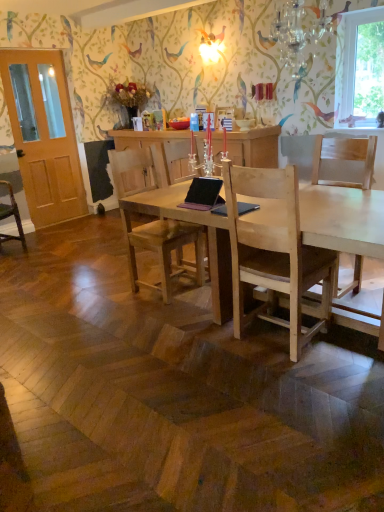
Question: Is light brown wooden chair at center, which is the second chair in right-to-left order, at the left side of natural wood desk at center?

Choices:
 (A) no
 (B) yes

Answer: (B)

Question: Is light brown wooden chair at center, which is the second chair in right-to-left order, thinner than natural wood desk at center?

Choices:
 (A) no
 (B) yes

Answer: (B)

Question: Is light brown wooden chair at center, which is the second chair in back-to-front order, located outside natural wood desk at center?

Choices:
 (A) yes
 (B) no

Answer: (B)

Question: Is light brown wooden chair at center, which ranks as the second chair in front-to-back order, behind natural wood desk at center?

Choices:
 (A) no
 (B) yes

Answer: (B)

Question: Is natural wood desk at center surrounded by light brown wooden chair at center, which is the second chair in back-to-front order?

Choices:
 (A) yes
 (B) no

Answer: (B)

Question: Considering the relative sizes of light brown wooden chair at center, which is the second chair in back-to-front order, and natural wood desk at center in the image provided, is light brown wooden chair at center, which is the second chair in back-to-front order, taller than natural wood desk at center?

Choices:
 (A) no
 (B) yes

Answer: (B)

Question: Is crystal glass chandelier at upper center positioned in front of light brown wooden chair at center, which is the second chair in right-to-left order?

Choices:
 (A) no
 (B) yes

Answer: (B)

Question: Does crystal glass chandelier at upper center have a smaller size compared to light brown wooden chair at center, which is the second chair in back-to-front order?

Choices:
 (A) no
 (B) yes

Answer: (B)

Question: From a real-world perspective, is crystal glass chandelier at upper center on top of light brown wooden chair at center, which is the second chair in back-to-front order?

Choices:
 (A) no
 (B) yes

Answer: (B)

Question: Is crystal glass chandelier at upper center placed right next to light brown wooden chair at center, the second chair when ordered from left to right?

Choices:
 (A) yes
 (B) no

Answer: (B)

Question: Considering the relative sizes of crystal glass chandelier at upper center and light brown wooden chair at center, which ranks as the second chair in front-to-back order, in the image provided, is crystal glass chandelier at upper center taller than light brown wooden chair at center, which ranks as the second chair in front-to-back order,?

Choices:
 (A) no
 (B) yes

Answer: (A)

Question: Considering the relative sizes of crystal glass chandelier at upper center and light brown wooden chair at center, the second chair when ordered from left to right, in the image provided, is crystal glass chandelier at upper center shorter than light brown wooden chair at center, the second chair when ordered from left to right,?

Choices:
 (A) no
 (B) yes

Answer: (B)

Question: Does light wood chair at center, marked as the first chair in a front-to-back arrangement, appear on the left side of clear glass window at upper right?

Choices:
 (A) yes
 (B) no

Answer: (A)